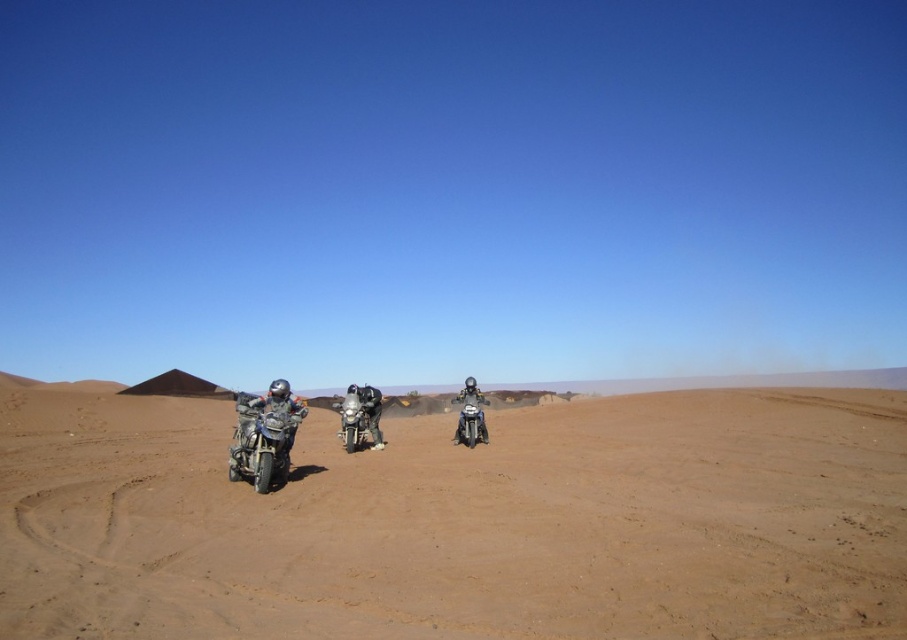
You are a photographer positioned at the center of the desert scene. You want to capture a photo of the brushed metal motorcycle at left without the brown sandy dirt at center appearing in the foreground. Is this possible?

The brown sandy dirt at center is in front of the brushed metal motorcycle at left, so it will block the view. You cannot take a photo of the brushed metal motorcycle at left without the brown sandy dirt at center appearing in the foreground.

You are a photographer planning to capture a group photo of the metallic silver motorcycle at left and the brushed metal motorcycle at left. Since you want both bikes to appear equally prominent in the photo, which motorcycle should you position closer to the camera?

The metallic silver motorcycle at left has a smaller size compared to brushed metal motorcycle at left, so to make them appear equally prominent in the photo, you should position the smaller metallic silver motorcycle at left closer to the camera than the larger brushed metal motorcycle at left.

You are a photographer positioned at the center of the desert scene. You want to take a photo that includes both the metallic silver motorcycle at left and the brushed metal motorcycle at left. Which motorcycle should you move closer to in order to include both in your frame?

You should move closer to the metallic silver motorcycle at left because the brushed metal motorcycle at left is behind it, so moving closer to the front motorcycle will allow both to be visible in the frame.